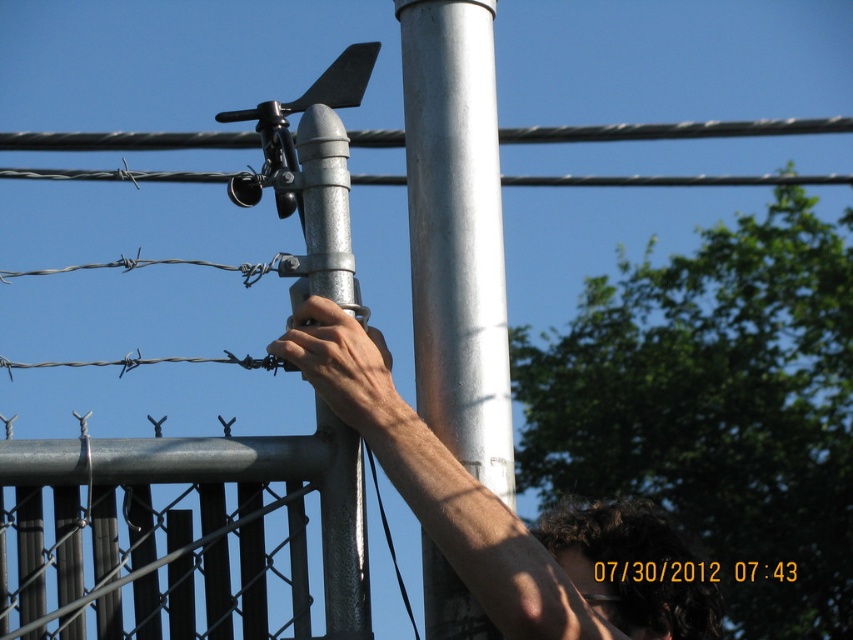
You are a maintenance worker checking the height of the galvanized metal pipe at center and the smooth metallic hand at center. Which object is taller?

The galvanized metal pipe at center is taller than the smooth metallic hand at center.

You are a maintenance worker checking the equipment. You need to reach the top of the silver metallic pole at center and the galvanized metal pipe at center. Which one will require you to climb higher?

The silver metallic pole at center is taller than the galvanized metal pipe at center, so you will need to climb higher to reach the top of the silver metallic pole at center.

You are a technician working on a metal structure outdoors. You notice hair at upper center and a galvanized metal pipe at center. Which object is closer to your current position?

The hair at upper center is closer to your current position since it is only 9.80 inches away from the galvanized metal pipe at center, implying it is nearer.